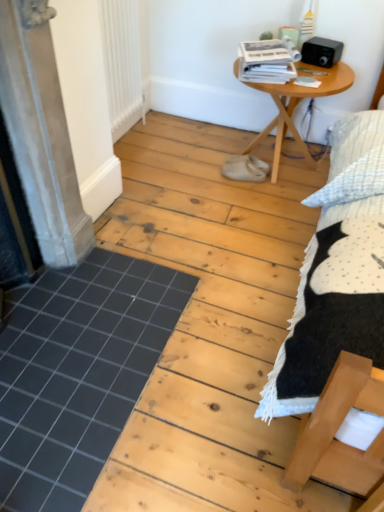
Question: In terms of height, does matte gray screen door at left look taller or shorter compared to wooden table at center?

Choices:
 (A) tall
 (B) short

Answer: (A)

Question: In the image, is matte gray screen door at left positioned in front of or behind wooden table at center?

Choices:
 (A) front
 (B) behind

Answer: (A)

Question: Which object is the closest to the black tile at lower left?

Choices:
 (A) white matte radiator at upper left
 (B) matte gray screen door at left
 (C) wooden table at center

Answer: (B)

Question: Which object is the farthest from the white matte radiator at upper left?

Choices:
 (A) wooden table at center
 (B) matte gray screen door at left
 (C) black tile at lower left

Answer: (C)